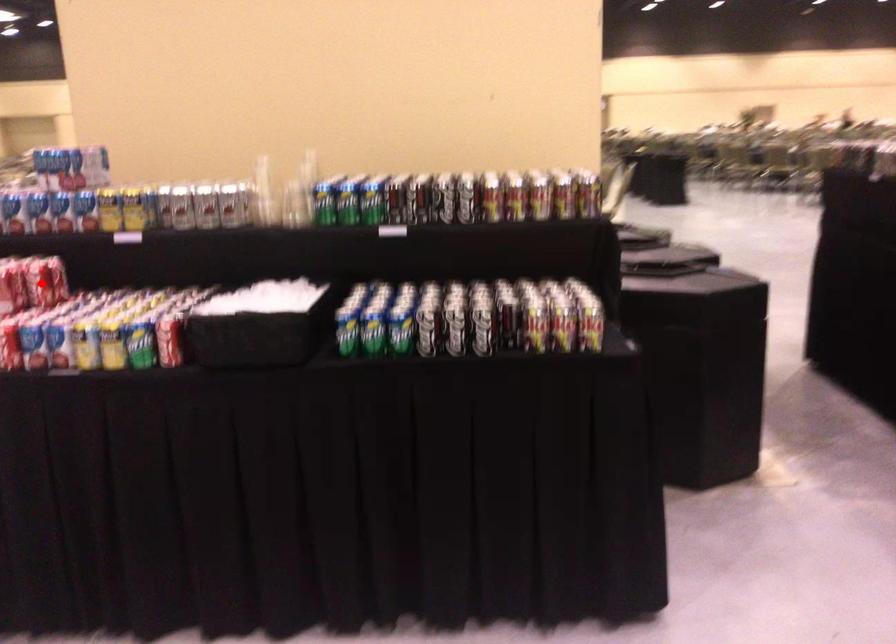
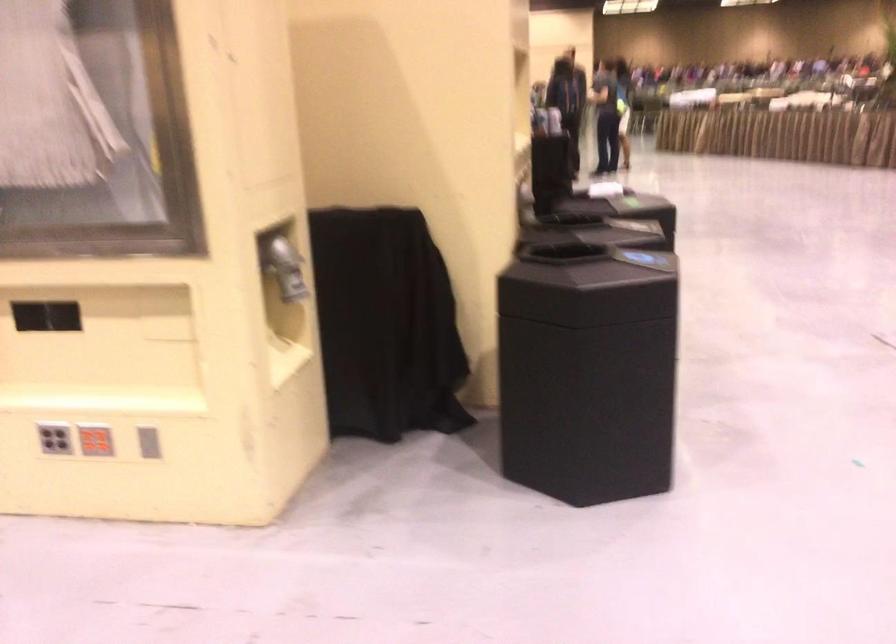
Question: I am providing you with two images of the same scene from different viewpoints. A red point is marked on the first image. At the location where the point appears in image 1, is it still visible in image 2?

Choices:
 (A) Yes
 (B) No

Answer: (B)